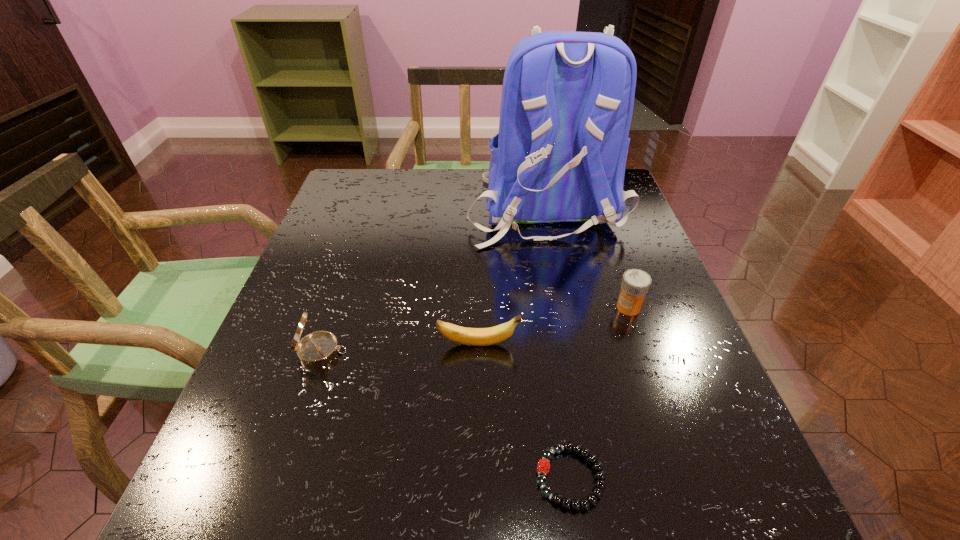
The image size is (960, 540). Find the location of `free space at the far edge of the desktop`. free space at the far edge of the desktop is located at coordinates (421, 211).

In the image, there is a desktop. Where is `free region at the near edge`? This screenshot has height=540, width=960. free region at the near edge is located at coordinates (468, 510).

The width and height of the screenshot is (960, 540). I want to click on free space at the left edge of the desktop, so click(254, 445).

Image resolution: width=960 pixels, height=540 pixels. In the image, there is a desktop. What are the coordinates of `free space at the right edge` in the screenshot? It's located at (637, 323).

Locate an element on the screen. free space that is in between the farthest object and the shortest object is located at coordinates (558, 343).

At what (x,y) coordinates should I click in order to perform the action: click on vacant area that lies between the leftmost object and the banana. Please return your answer as a coordinate pair (x, y). The width and height of the screenshot is (960, 540). Looking at the image, I should click on (400, 348).

Where is `free space between the compass and the tallest object`? free space between the compass and the tallest object is located at coordinates (433, 280).

Find the location of a particular element. The width and height of the screenshot is (960, 540). free spot between the medicine and the shortest object is located at coordinates (599, 393).

Find the location of a particular element. Image resolution: width=960 pixels, height=540 pixels. empty location between the tallest object and the compass is located at coordinates (433, 280).

The width and height of the screenshot is (960, 540). In order to click on free spot between the farthest object and the banana in this screenshot , I will do `click(512, 276)`.